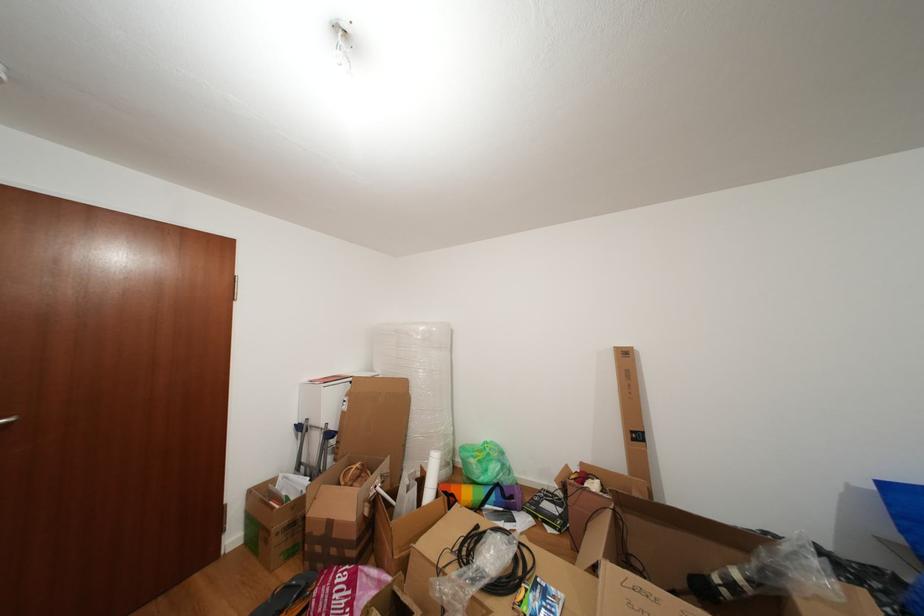
What do you see at coordinates (431, 477) in the screenshot?
I see `the white paper roll` at bounding box center [431, 477].